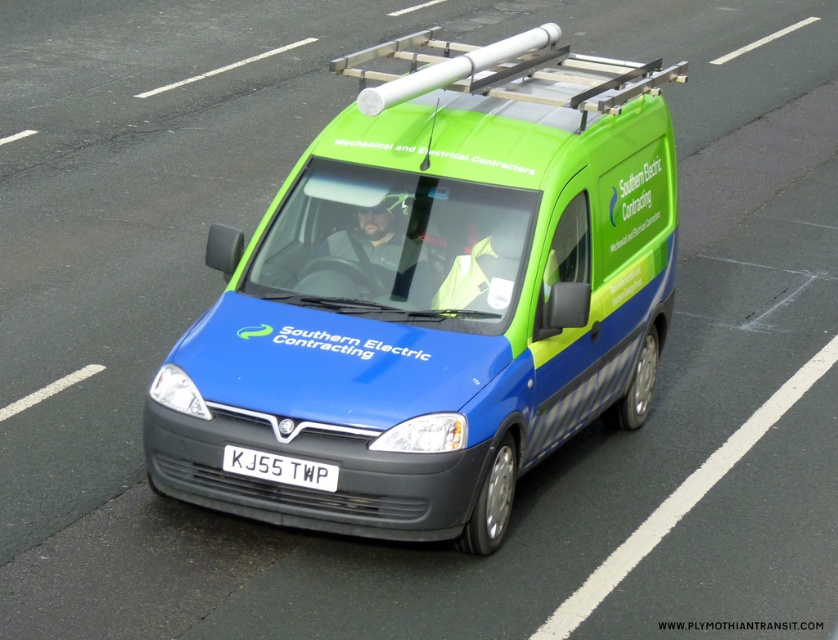
Is the position of blue matte van at center more distant than that of white plastic license plate at center?

That is False.

The height and width of the screenshot is (640, 838). What are the coordinates of `blue matte van at center` in the screenshot? It's located at (433, 294).

Find the location of a particular element. blue matte van at center is located at coordinates (433, 294).